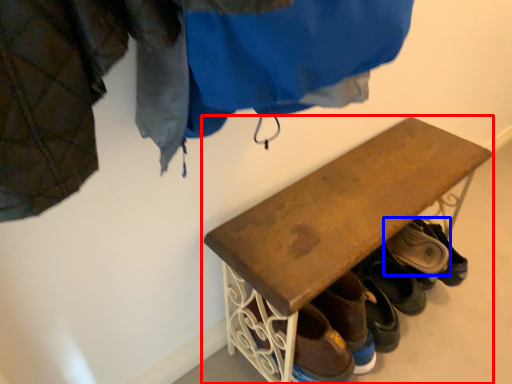
Question: Which point is further to the camera, furniture (highlighted by a red box) or footwear (highlighted by a blue box)?

Choices:
 (A) furniture
 (B) footwear

Answer: (B)